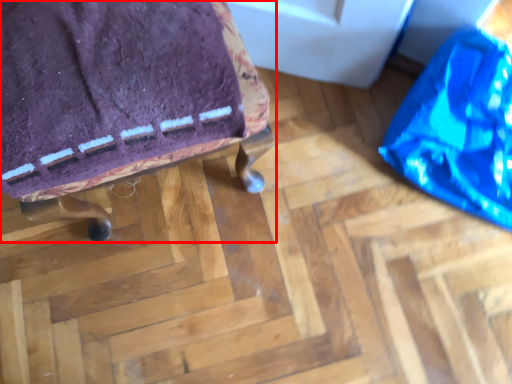
Question: Where is furniture (annotated by the red box) located in relation to bean bag chair in the image?

Choices:
 (A) left
 (B) right

Answer: (A)